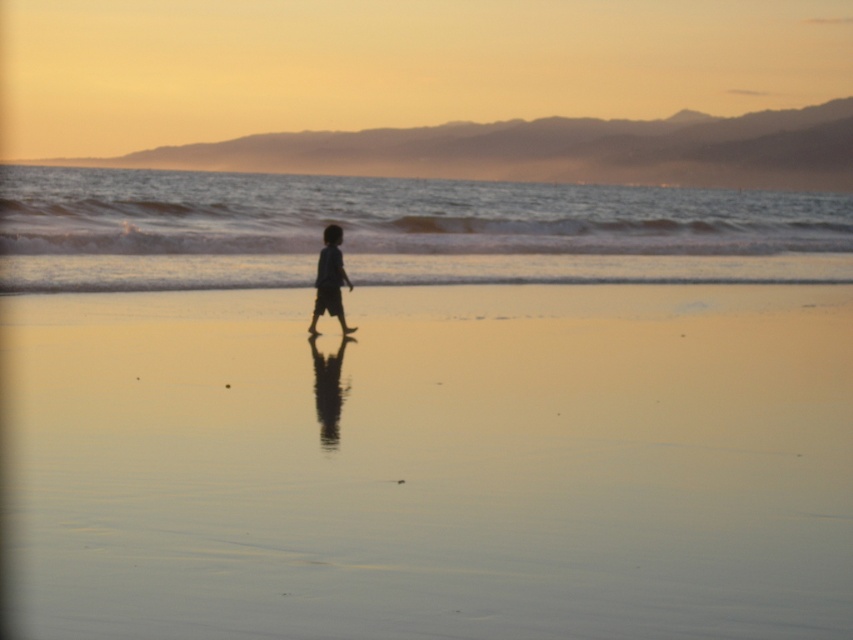
Is clear water at center wider than silhouette cotton boy at center?

Correct, the width of clear water at center exceeds that of silhouette cotton boy at center.

Is point (144, 278) less distant than point (315, 294)?

No, it is not.

Who is more forward, (842, 268) or (337, 227)?

Point (337, 227)

The width and height of the screenshot is (853, 640). What are the coordinates of `clear water at center` in the screenshot? It's located at click(399, 230).

From the picture: Between smooth sand at center and silhouette cotton boy at center, which one appears on the left side from the viewer's perspective?

silhouette cotton boy at center

Is smooth sand at center to the right of silhouette cotton boy at center from the viewer's perspective?

Correct, you'll find smooth sand at center to the right of silhouette cotton boy at center.

Is point (558, 596) closer to camera compared to point (318, 316)?

Yes, it is.

Image resolution: width=853 pixels, height=640 pixels. Identify the location of smooth sand at center. (430, 461).

Does smooth sand at center have a larger size compared to clear water at center?

Actually, smooth sand at center might be smaller than clear water at center.

Is smooth sand at center to the left of clear water at center from the viewer's perspective?

In fact, smooth sand at center is to the right of clear water at center.

Does point (323, 596) lie behind point (485, 256)?

No, it is in front of (485, 256).

Identify the location of smooth sand at center. (x=430, y=461).